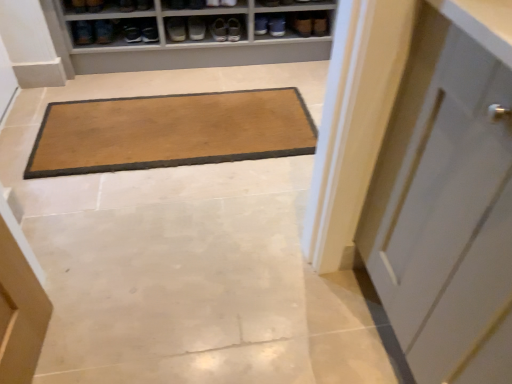
Question: Would you consider matte black shoe at upper center, arranged as the 4th shoe when viewed from the left, to be distant from brown suede shoe at upper left, marked as the 1th shoe in a left-to-right arrangement?

Choices:
 (A) no
 (B) yes

Answer: (A)

Question: Does matte black shoe at upper center, which ranks as the second shoe in right-to-left order, have a lesser width compared to brown suede shoe at upper left, marked as the 1th shoe in a left-to-right arrangement?

Choices:
 (A) no
 (B) yes

Answer: (A)

Question: Can you confirm if matte black shoe at upper center, arranged as the 4th shoe when viewed from the left, is wider than brown suede shoe at upper left, marked as the 1th shoe in a left-to-right arrangement?

Choices:
 (A) no
 (B) yes

Answer: (B)

Question: Could you tell me if matte black shoe at upper center, which ranks as the second shoe in right-to-left order, is facing brown suede shoe at upper left, which ranks as the fifth shoe in right-to-left order?

Choices:
 (A) no
 (B) yes

Answer: (A)

Question: Is matte black shoe at upper center, arranged as the 4th shoe when viewed from the left, placed right next to brown suede shoe at upper left, which ranks as the fifth shoe in right-to-left order?

Choices:
 (A) yes
 (B) no

Answer: (B)

Question: Is brown suede shoe at upper left, which ranks as the fifth shoe in right-to-left order, surrounded by matte black shoe at upper center, arranged as the 4th shoe when viewed from the left?

Choices:
 (A) no
 (B) yes

Answer: (A)

Question: Can you confirm if matte gray shoe at upper center, positioned as the 5th footwear in left-to-right order, is bigger than matte black shoe at upper left, the 1th footwear in the left-to-right sequence?

Choices:
 (A) no
 (B) yes

Answer: (A)

Question: Is matte gray shoe at upper center, which ranks as the first footwear in right-to-left order, thinner than matte black shoe at upper left, the 1th footwear in the left-to-right sequence?

Choices:
 (A) yes
 (B) no

Answer: (B)

Question: From a real-world perspective, is matte gray shoe at upper center, which ranks as the first footwear in right-to-left order, beneath matte black shoe at upper left, the 1th footwear in the left-to-right sequence?

Choices:
 (A) no
 (B) yes

Answer: (B)

Question: Is matte gray shoe at upper center, positioned as the 5th footwear in left-to-right order, not inside matte black shoe at upper left, the 1th footwear in the left-to-right sequence?

Choices:
 (A) no
 (B) yes

Answer: (B)

Question: Considering the relative sizes of matte gray shoe at upper center, which ranks as the first footwear in right-to-left order, and matte black shoe at upper left, the 1th footwear in the left-to-right sequence, in the image provided, is matte gray shoe at upper center, which ranks as the first footwear in right-to-left order, wider than matte black shoe at upper left, the 1th footwear in the left-to-right sequence,?

Choices:
 (A) yes
 (B) no

Answer: (A)

Question: Is matte gray shoe at upper center, which ranks as the first footwear in right-to-left order, positioned before matte black shoe at upper left, which is the 5th footwear from right to left?

Choices:
 (A) no
 (B) yes

Answer: (A)

Question: Considering the relative sizes of brown suede shoe at upper left, which ranks as the fifth shoe in right-to-left order, and brown suede shoe at upper center, which is the fifth shoe from left to right, in the image provided, is brown suede shoe at upper left, which ranks as the fifth shoe in right-to-left order, shorter than brown suede shoe at upper center, which is the fifth shoe from left to right,?

Choices:
 (A) no
 (B) yes

Answer: (A)